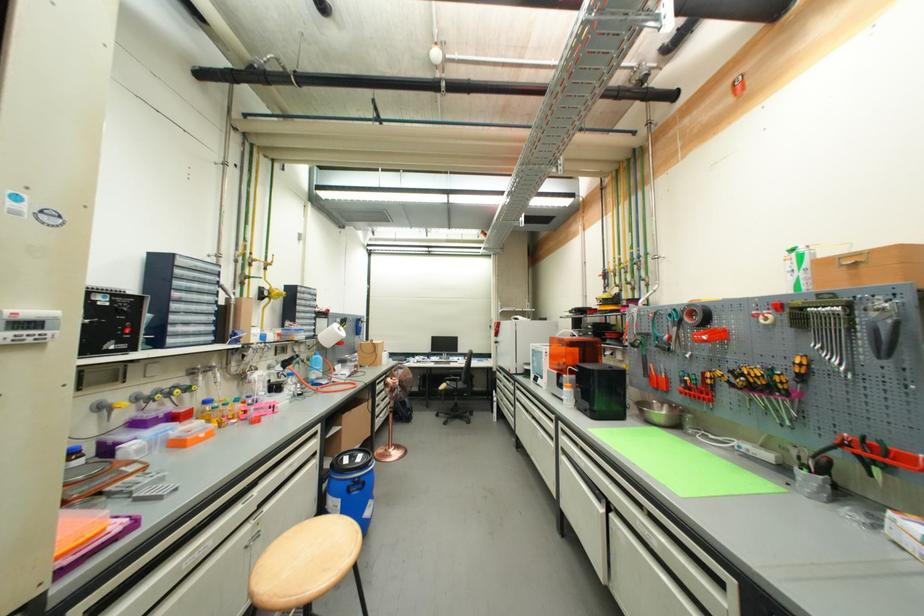
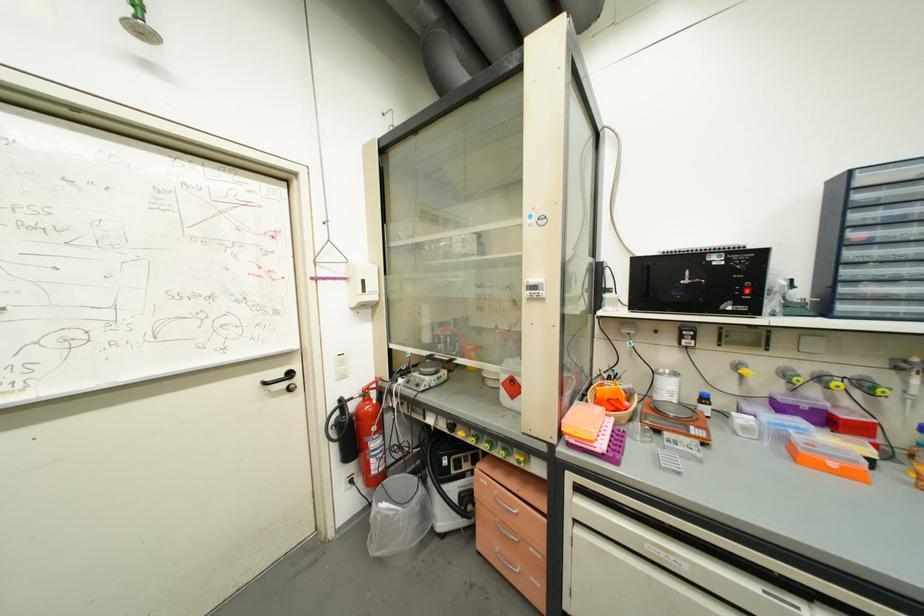
Where in the second image is the point corresponding to point 258,498 from the first image?

(803, 610)